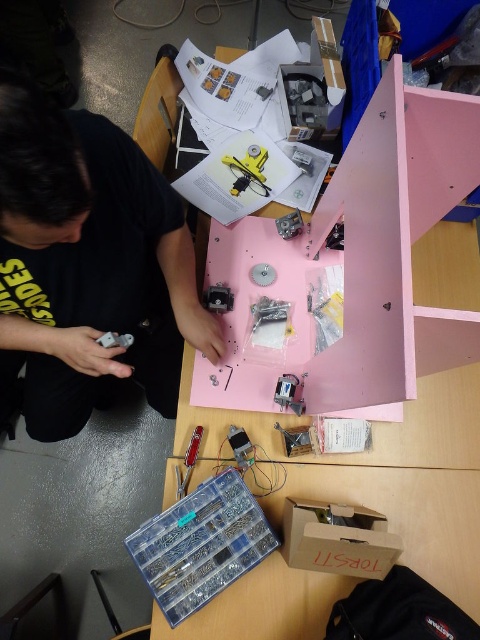
You are standing in front of the workspace and want to pick up the object nearest to you. Which point should you reach for, point A at coordinates point A is point (309, 500) or point B at coordinates point B is point (240, 163)?

You should reach for point A at coordinates point A is point (309, 500) because it is closer to you than point B at coordinates point B is point (240, 163).

You are organizing parts for a mechanical project. You have a cardboard box at lower center and a yellow plastic gear at center. Which object should you place in a storage container first if you need to prioritize smaller items?

You should place the yellow plastic gear at center first because it is smaller than the cardboard box at lower center.

You are an observer looking at the workspace. Which object is closer to you between the matte black shirt at upper left and the yellow plastic gear at center?

The matte black shirt at upper left is closer to you because it is in front of the yellow plastic gear at center.